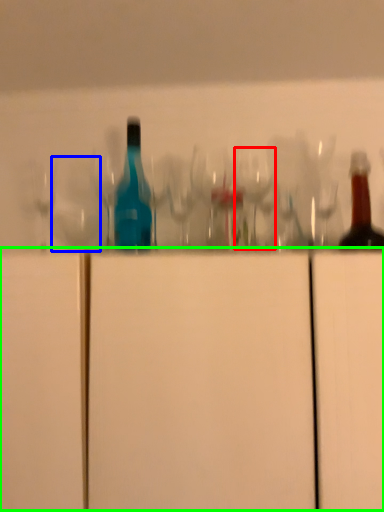
Question: Which is farther away from wine glass (highlighted by a red box)? shot glass (highlighted by a blue box) or cabinetry (highlighted by a green box)?

Choices:
 (A) shot glass
 (B) cabinetry

Answer: (B)